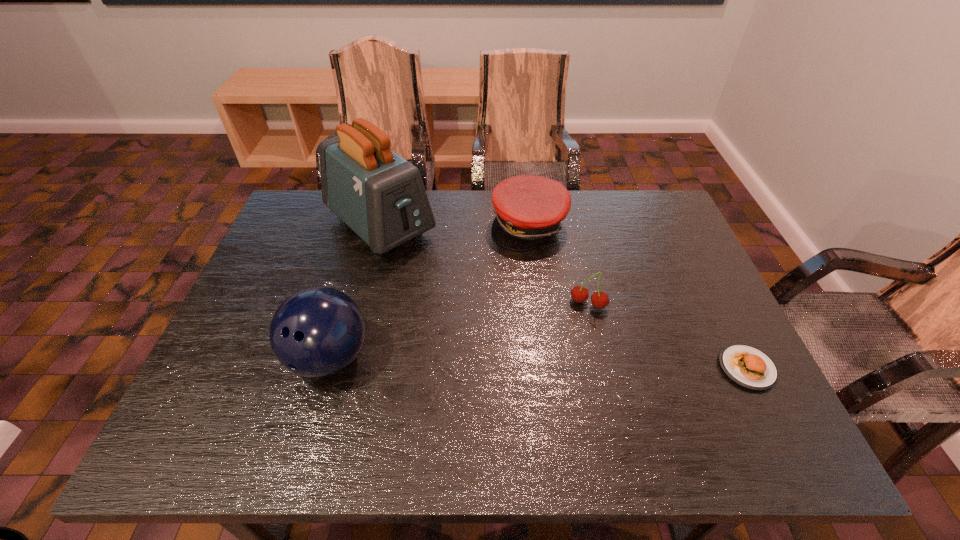
Where is `free space between the bowling ball and the rightmost object`? free space between the bowling ball and the rightmost object is located at coordinates (538, 363).

The width and height of the screenshot is (960, 540). What are the coordinates of `vacant area that lies between the toaster and the cap` in the screenshot? It's located at (455, 225).

The image size is (960, 540). What are the coordinates of `free point between the fourth shortest object and the cap` in the screenshot? It's located at (429, 292).

Where is `vacant region between the shortest object and the tallest object`? vacant region between the shortest object and the tallest object is located at coordinates (564, 296).

The width and height of the screenshot is (960, 540). In order to click on free space that is in between the cap and the third nearest object in this screenshot , I will do `click(559, 264)`.

Identify the location of free spot between the bowling ball and the third farthest object. (459, 330).

This screenshot has width=960, height=540. Identify the location of blank region between the food and the cap. (637, 296).

Find the location of `empty space between the cap and the bowling ball`. empty space between the cap and the bowling ball is located at coordinates (429, 292).

Where is `empty space that is in between the third nearest object and the cap`? The height and width of the screenshot is (540, 960). empty space that is in between the third nearest object and the cap is located at coordinates (559, 264).

In order to click on the closest object to the shortest object in this screenshot , I will do (x=579, y=294).